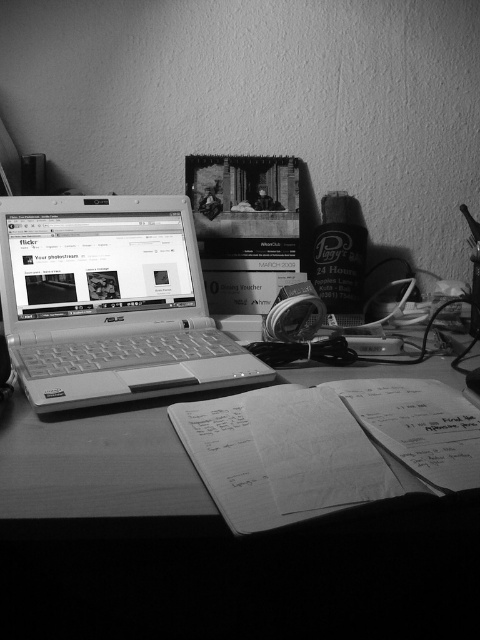
Question: Estimate the real-world distances between objects in this image. Which object is closer to the metallic silver laptop at left?

Choices:
 (A) white paper at center
 (B) wooden table at center

Answer: (B)

Question: Estimate the real-world distances between objects in this image. Which object is farther from the white paper at center?

Choices:
 (A) metallic silver laptop at left
 (B) wooden table at center

Answer: (A)

Question: Which object is the farthest from the metallic silver laptop at left?

Choices:
 (A) wooden table at center
 (B) white paper at center

Answer: (B)

Question: Can you confirm if white paper at center is thinner than wooden table at center?

Choices:
 (A) yes
 (B) no

Answer: (B)

Question: Is metallic silver laptop at left thinner than wooden table at center?

Choices:
 (A) no
 (B) yes

Answer: (A)

Question: Is metallic silver laptop at left thinner than wooden table at center?

Choices:
 (A) yes
 (B) no

Answer: (B)